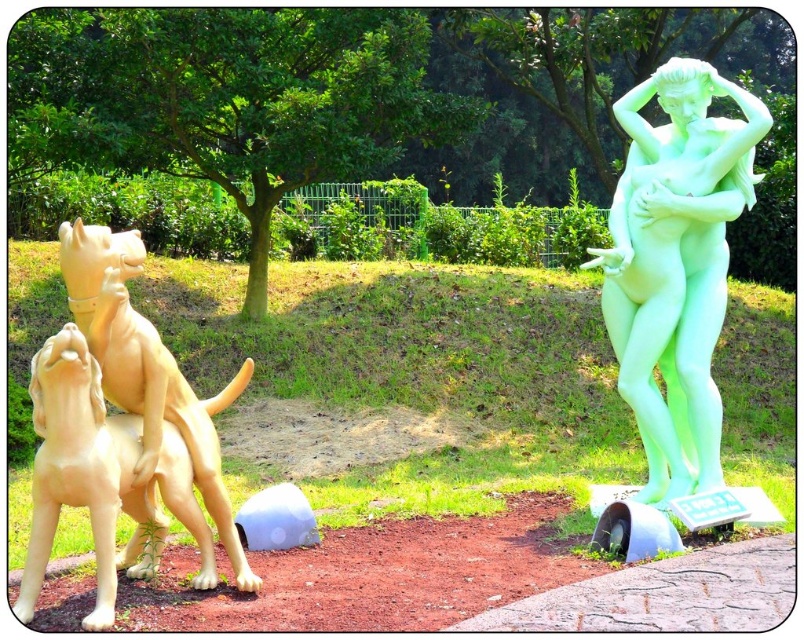
Measure the distance between green translucent statue at right and camera.

6.03 meters

Where is `green translucent statue at right`? The height and width of the screenshot is (640, 804). green translucent statue at right is located at coordinates (675, 264).